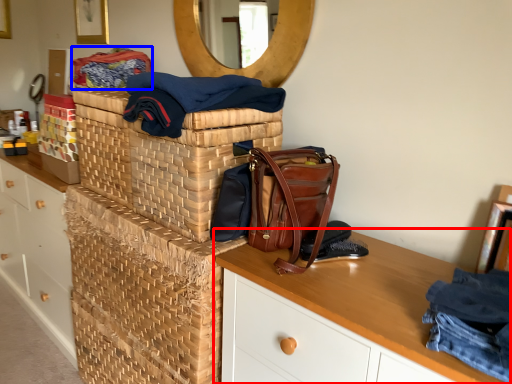
Question: Among these objects, which one is farthest to the camera, desk (highlighted by a red box) or material (highlighted by a blue box)?

Choices:
 (A) desk
 (B) material

Answer: (B)